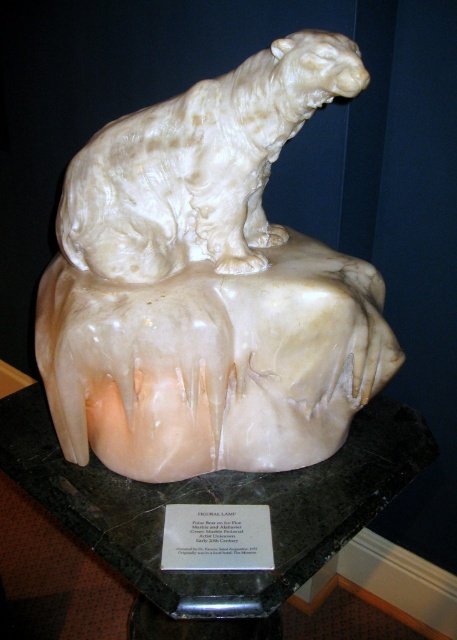
Image resolution: width=457 pixels, height=640 pixels. In order to click on white marble lion at center in this screenshot , I will do `click(207, 285)`.

You are a GUI agent. You are given a task and a screenshot of the screen. Output one action in this format:
    pyautogui.click(x=<x>, y=<y>)
    Task: Click on the white marble lion at center
    The width and height of the screenshot is (457, 640).
    Given the screenshot: What is the action you would take?
    pyautogui.click(x=207, y=285)